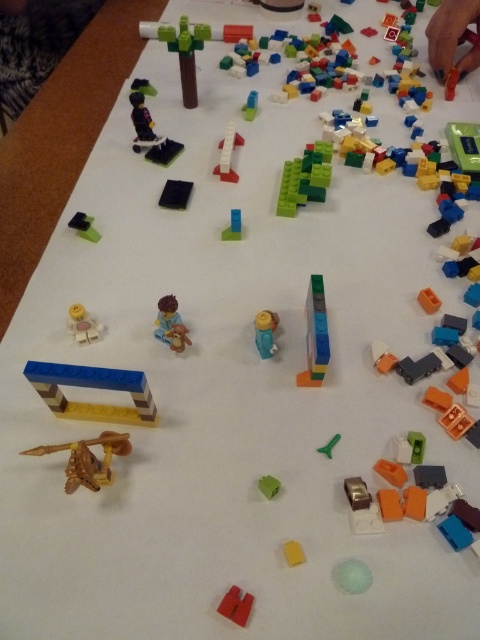
Question: Which point is farther from the camera taking this photo?

Choices:
 (A) (199, 38)
 (B) (162, 202)
 (C) (342, 582)
 (D) (100, 467)

Answer: (A)

Question: From the image, what is the correct spatial relationship of yellow matte figure at center in relation to black matte rectangular block at center?

Choices:
 (A) left
 (B) right

Answer: (B)

Question: Considering the real-world distances, which object is closest to the green matte toothpick at center?

Choices:
 (A) wooden toy airplane at lower left
 (B) matte brown minifigure at center

Answer: (B)

Question: Which point is closer to the camera?

Choices:
 (A) (433, 54)
 (B) (85, 324)
 (C) (184, 76)

Answer: (B)

Question: Does wooden toy airplane at lower left appear on the left side of matte brown minifigure at center?

Choices:
 (A) yes
 (B) no

Answer: (A)

Question: Does green matte sphere at center appear under black matte rectangular block at center?

Choices:
 (A) no
 (B) yes

Answer: (B)